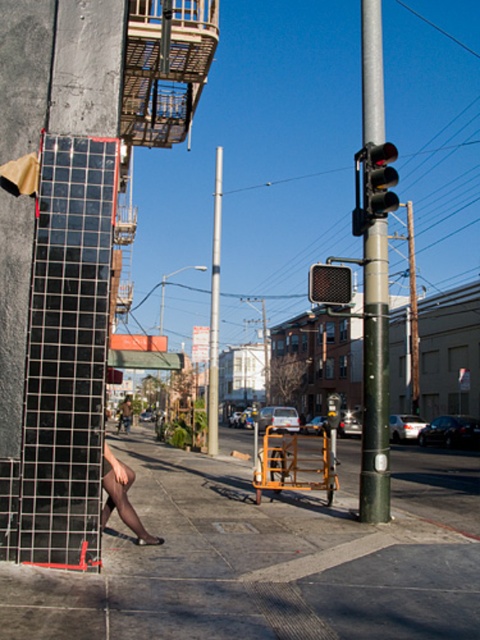
Question: Estimate the real-world distances between objects in this image. Which object is closer to the green metallic pole at center?

Choices:
 (A) smooth silver pole at center
 (B) black tights at lower left

Answer: (B)

Question: Can you confirm if concrete sidewalk at lower left is positioned below black glass traffic light at upper right?

Choices:
 (A) no
 (B) yes

Answer: (B)

Question: Which object is closer to the camera taking this photo?

Choices:
 (A) green metallic pole at center
 (B) smooth silver pole at center
 (C) concrete sidewalk at lower left
 (D) black glass traffic light at upper right

Answer: (C)

Question: Among these objects, which one is nearest to the camera?

Choices:
 (A) concrete sidewalk at lower left
 (B) black tights at lower left
 (C) black glass traffic light at upper right
 (D) green metallic pole at center

Answer: (A)

Question: Is black glass traffic light at upper right to the left of black tights at lower left from the viewer's perspective?

Choices:
 (A) no
 (B) yes

Answer: (A)

Question: Is black glass traffic light at upper right positioned at the back of black tights at lower left?

Choices:
 (A) yes
 (B) no

Answer: (A)